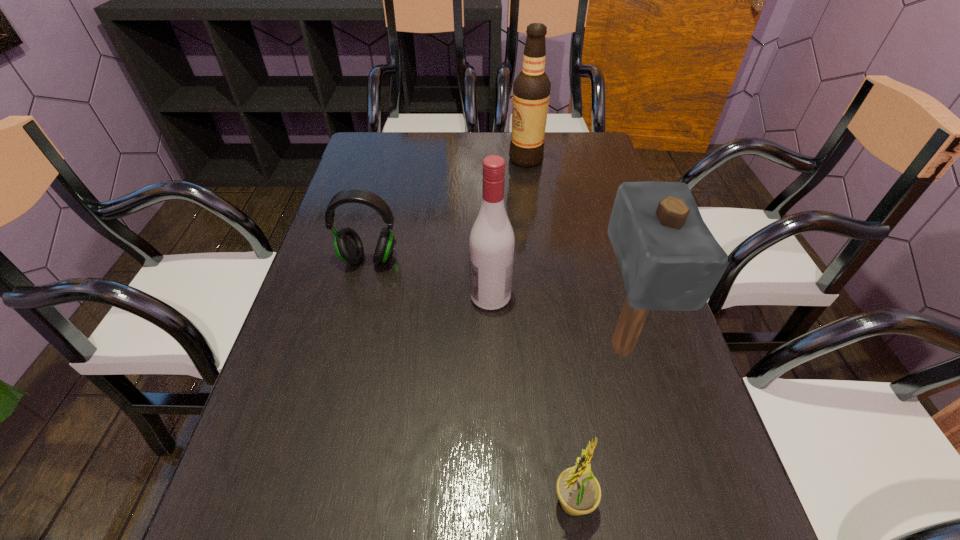
The width and height of the screenshot is (960, 540). I want to click on the farthest object, so click(x=531, y=89).

The image size is (960, 540). Identify the location of the right alcohol. (531, 89).

Where is `mallet`? mallet is located at coordinates (669, 259).

Where is `the fourth object from right to left`? the fourth object from right to left is located at coordinates (492, 241).

The width and height of the screenshot is (960, 540). In order to click on the nearer alcohol in this screenshot , I will do `click(492, 241)`.

Image resolution: width=960 pixels, height=540 pixels. In order to click on the second farthest object in this screenshot , I will do `click(347, 243)`.

The image size is (960, 540). Find the location of `headset`. headset is located at coordinates (347, 243).

What are the coordinates of `the nearest object` in the screenshot? It's located at (578, 490).

The height and width of the screenshot is (540, 960). I want to click on free space located 0.260m on the label of the farther alcohol, so click(428, 159).

Locate an element on the screen. The width and height of the screenshot is (960, 540). vacant space located on the label of the farther alcohol is located at coordinates (409, 159).